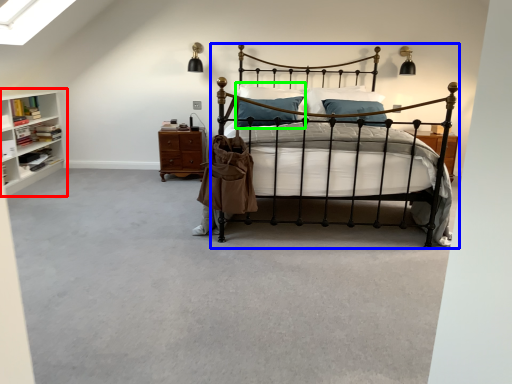
Question: Considering the real-world distances, which object is closest to shelf (highlighted by a red box)? bed (highlighted by a blue box) or pillow (highlighted by a green box).

Choices:
 (A) bed
 (B) pillow

Answer: (B)